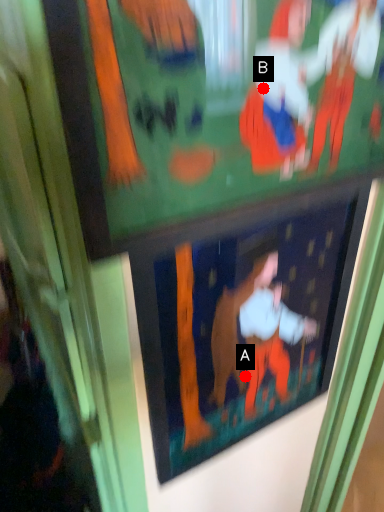
Question: Two points are circled on the image, labeled by A and B beside each circle. Which point is further to the camera?

Choices:
 (A) A is further
 (B) B is further

Answer: (A)